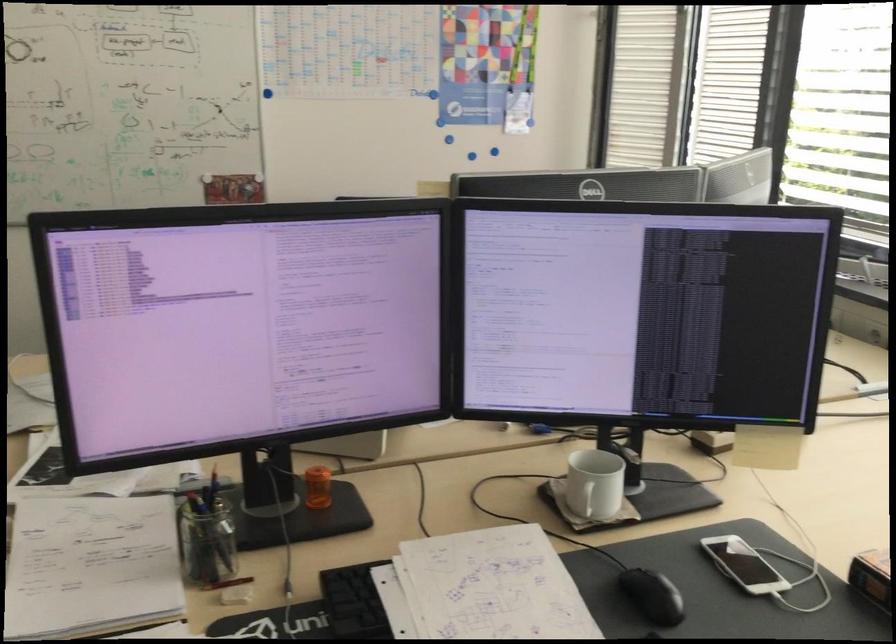
What are the coordinates of `white eraser` in the screenshot? It's located at (234, 596).